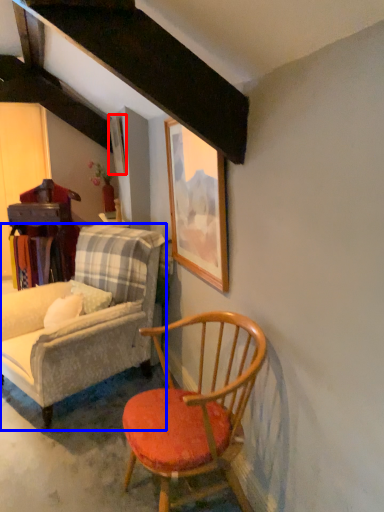
Question: Which point is closer to the camera, picture frame (highlighted by a red box) or chair (highlighted by a blue box)?

Choices:
 (A) picture frame
 (B) chair

Answer: (B)